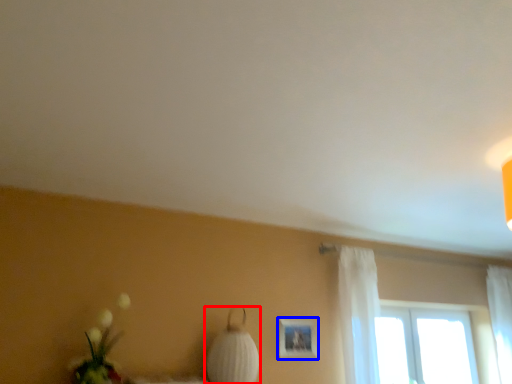
Question: Which object appears farthest to the camera in this image, table lamp (highlighted by a red box) or picture frame (highlighted by a blue box)?

Choices:
 (A) table lamp
 (B) picture frame

Answer: (B)